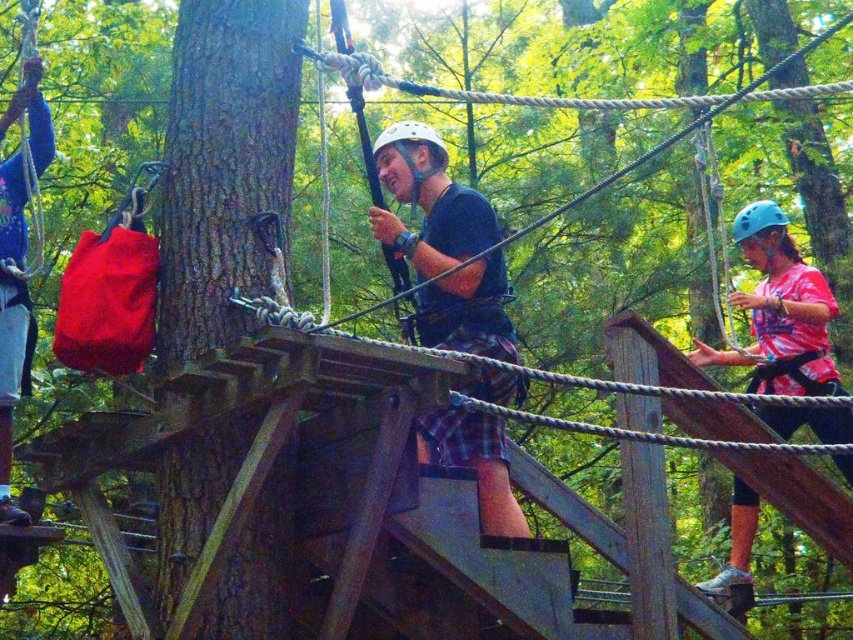
What do you see at coordinates (779, 312) in the screenshot?
I see `pink matte shirt at right` at bounding box center [779, 312].

Is pink matte shirt at right closer to the viewer compared to blue fabric bag at left?

That is False.

Who is more distant from viewer, (741, 250) or (24, 244)?

The point (741, 250) is more distant.

In order to click on pink matte shirt at right in this screenshot , I will do `click(779, 312)`.

Is point (4, 451) farther from viewer compared to point (260, 314)?

Yes.

Can you confirm if blue fabric bag at left is thinner than wooden bridge at center?

Indeed, blue fabric bag at left has a lesser width compared to wooden bridge at center.

Between point (10, 97) and point (279, 298), which one is positioned behind?

Point (10, 97)

This screenshot has height=640, width=853. What are the coordinates of `blue fabric bag at left` in the screenshot? It's located at (12, 321).

Is point (770, 333) behind point (786, 218)?

No, (770, 333) is closer to viewer.

Between pink matte shirt at right and blue matte helmet at upper right, which one appears on the left side from the viewer's perspective?

blue matte helmet at upper right

Is point (769, 275) farther from camera compared to point (781, 248)?

That is True.

This screenshot has height=640, width=853. Identify the location of pink matte shirt at right. (779, 312).